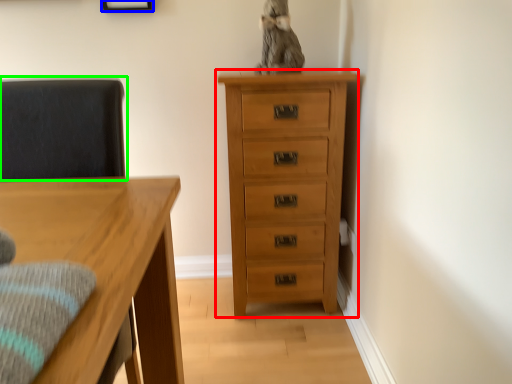
Question: Which object is positioned farthest from chest of drawers (highlighted by a red box)? Select from picture frame (highlighted by a blue box) and swivel chair (highlighted by a green box).

Choices:
 (A) picture frame
 (B) swivel chair

Answer: (A)